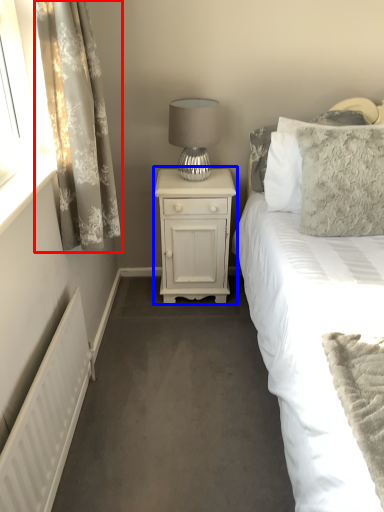
Question: Which object is further to the camera taking this photo, curtain (highlighted by a red box) or nightstand (highlighted by a blue box)?

Choices:
 (A) curtain
 (B) nightstand

Answer: (B)